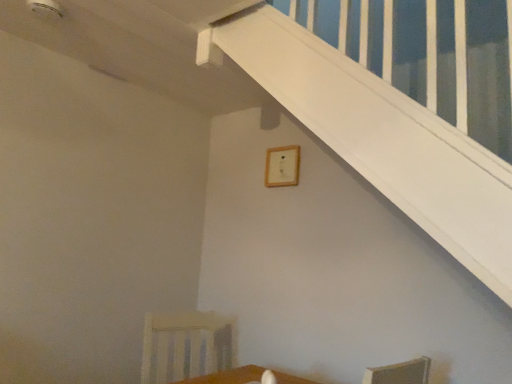
Question: Should I look upward or downward to see wooden frame at upper center?

Choices:
 (A) down
 (B) up

Answer: (B)

Question: Is white wood armchair at lower left bigger than wooden frame at upper center?

Choices:
 (A) no
 (B) yes

Answer: (B)

Question: Considering the relative positions of white wood armchair at lower left and wooden frame at upper center in the image provided, is white wood armchair at lower left in front of wooden frame at upper center?

Choices:
 (A) yes
 (B) no

Answer: (A)

Question: Considering the relative sizes of white wood armchair at lower left and wooden frame at upper center in the image provided, is white wood armchair at lower left thinner than wooden frame at upper center?

Choices:
 (A) yes
 (B) no

Answer: (B)

Question: Is white wood armchair at lower left shorter than wooden frame at upper center?

Choices:
 (A) no
 (B) yes

Answer: (A)

Question: Is white wood armchair at lower left further to camera compared to wooden frame at upper center?

Choices:
 (A) no
 (B) yes

Answer: (A)

Question: Considering the relative sizes of white wood armchair at lower left and wooden frame at upper center in the image provided, is white wood armchair at lower left smaller than wooden frame at upper center?

Choices:
 (A) no
 (B) yes

Answer: (A)

Question: From a real-world perspective, is wooden frame at upper center on white wood armchair at lower left?

Choices:
 (A) no
 (B) yes

Answer: (B)

Question: Is the depth of wooden frame at upper center greater than that of white wood armchair at lower left?

Choices:
 (A) yes
 (B) no

Answer: (A)

Question: From a real-world perspective, is wooden frame at upper center under white wood armchair at lower left?

Choices:
 (A) no
 (B) yes

Answer: (A)

Question: Is wooden frame at upper center aimed at white wood armchair at lower left?

Choices:
 (A) yes
 (B) no

Answer: (B)

Question: Can you confirm if wooden frame at upper center is bigger than white wood armchair at lower left?

Choices:
 (A) yes
 (B) no

Answer: (B)

Question: Is wooden frame at upper center to the right of white wood armchair at lower left from the viewer's perspective?

Choices:
 (A) yes
 (B) no

Answer: (A)

Question: From the image's perspective, relative to white wood armchair at lower left, is wooden frame at upper center above or below?

Choices:
 (A) below
 (B) above

Answer: (B)